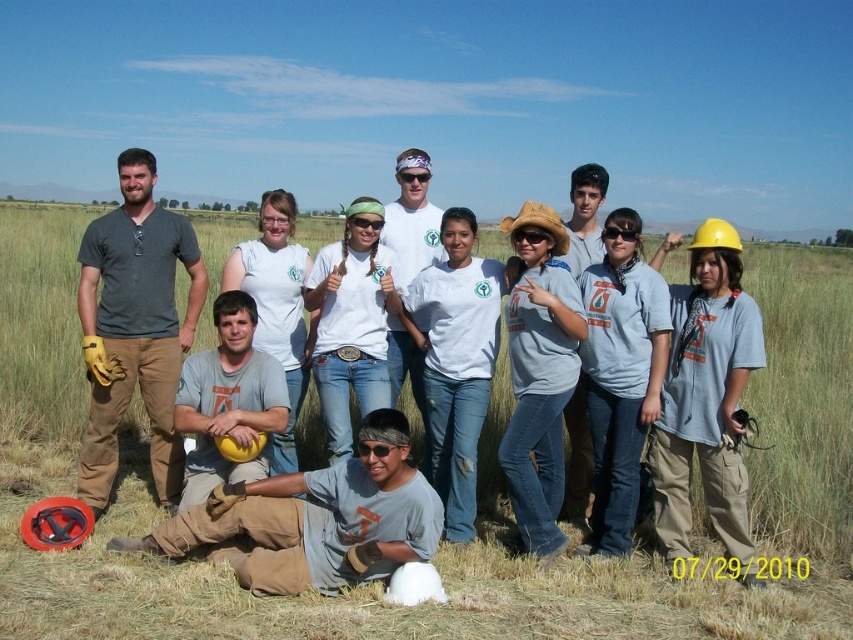
Question: Which point is closer to the camera?

Choices:
 (A) (585, 516)
 (B) (378, 502)
 (C) (727, 634)

Answer: (C)

Question: Does green grass at center appear on the left side of gray cotton t-shirt at center?

Choices:
 (A) no
 (B) yes

Answer: (B)

Question: Is gray cotton shirt at lower center below white cotton shirt at center?

Choices:
 (A) yes
 (B) no

Answer: (A)

Question: Is gray cotton shirt at lower center behind gray cotton t-shirt at center?

Choices:
 (A) yes
 (B) no

Answer: (B)

Question: Which object is the closest to the white cotton shirt at center?

Choices:
 (A) green grass at center
 (B) gray cotton shirt at lower center
 (C) gray cotton shirt at center
 (D) gray cotton t-shirt at center

Answer: (D)

Question: Which is farther from the gray cotton shirt at lower center?

Choices:
 (A) gray cotton shirt at center
 (B) gray cotton t-shirt at center
 (C) white cotton shirt at center

Answer: (A)